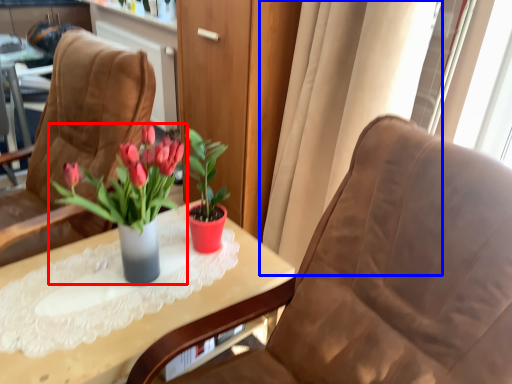
Question: Which object appears farthest to the camera in this image, houseplant (highlighted by a red box) or curtain (highlighted by a blue box)?

Choices:
 (A) houseplant
 (B) curtain

Answer: (B)